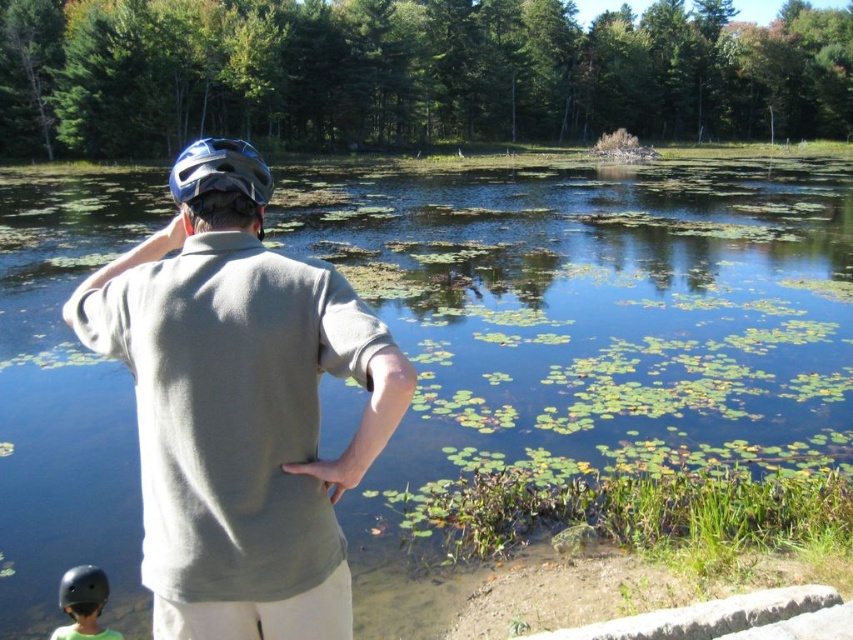
You are a photographer trying to capture a candid shot of the matte gray shirt at center and the black matte helmet at lower left. Since you want both subjects in focus, you need to know their horizontal alignment. Which object is positioned to the right of the other?

The matte gray shirt at center is positioned on the right side of black matte helmet at lower left.